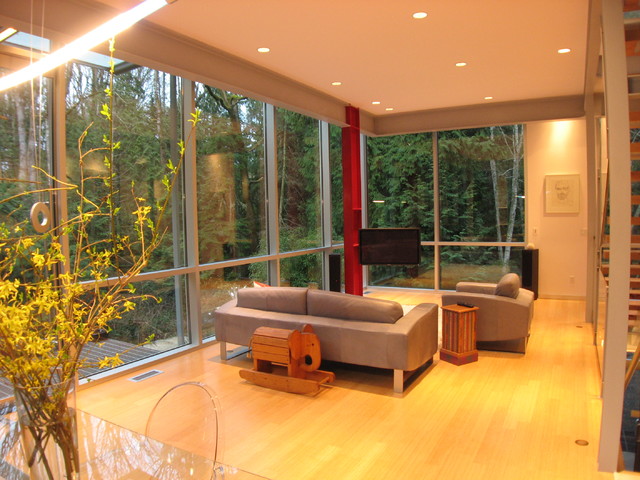
Identify the location of wall painting. (557, 186).